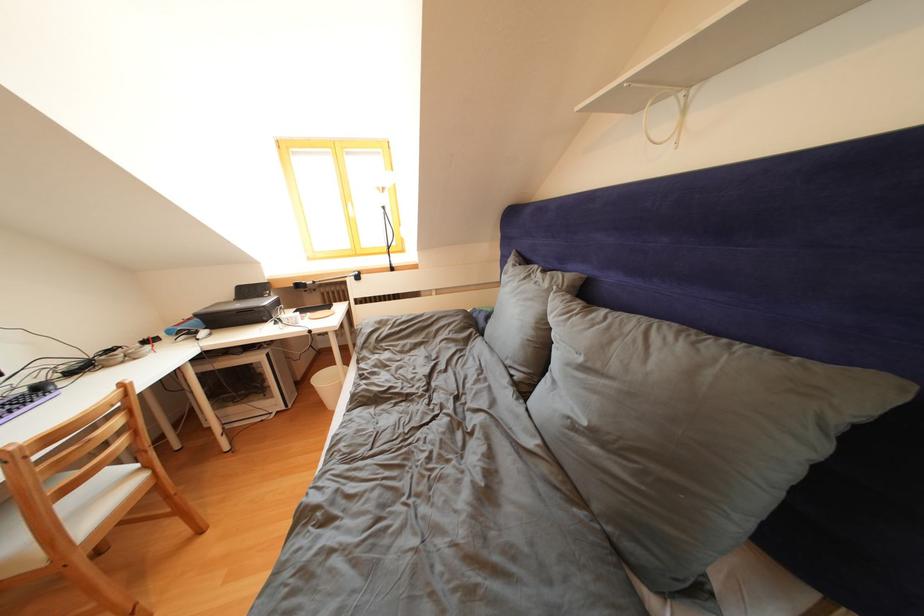
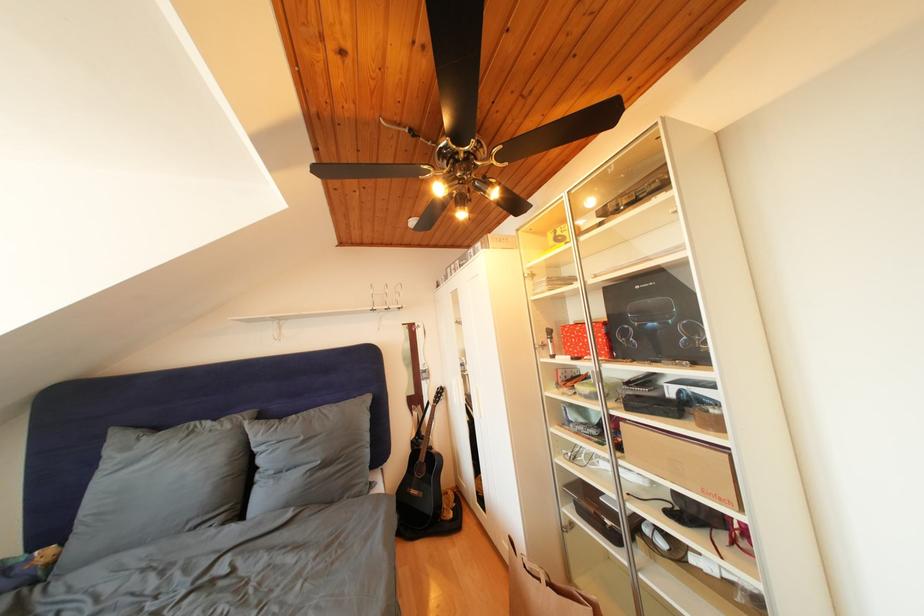
The point at (553, 290) is marked in the first image. Where is the corresponding point in the second image?

(236, 432)